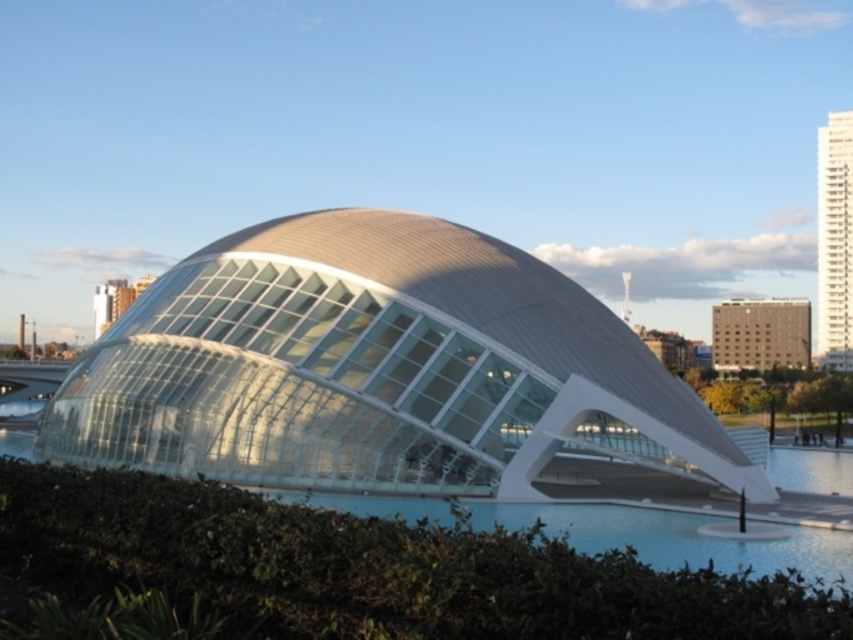
Does white glass dome at center appear over clear blue water at center?

Yes, white glass dome at center is above clear blue water at center.

Can you confirm if white glass dome at center is wider than clear blue water at center?

Yes.

Locate an element on the screen. Image resolution: width=853 pixels, height=640 pixels. white glass dome at center is located at coordinates (389, 374).

Can you confirm if white glass dome at center is shorter than white glass building at upper right?

Correct, white glass dome at center is not as tall as white glass building at upper right.

Who is shorter, white glass dome at center or white glass building at upper right?

white glass dome at center

The height and width of the screenshot is (640, 853). I want to click on white glass dome at center, so click(389, 374).

Which is in front, point (821, 140) or point (761, 326)?

Positioned in front is point (761, 326).

Can you confirm if white glass building at upper right is taller than beige concrete building at upper right?

Yes, white glass building at upper right is taller than beige concrete building at upper right.

What do you see at coordinates (834, 241) in the screenshot?
I see `white glass building at upper right` at bounding box center [834, 241].

Locate an element on the screen. The width and height of the screenshot is (853, 640). white glass building at upper right is located at coordinates (834, 241).